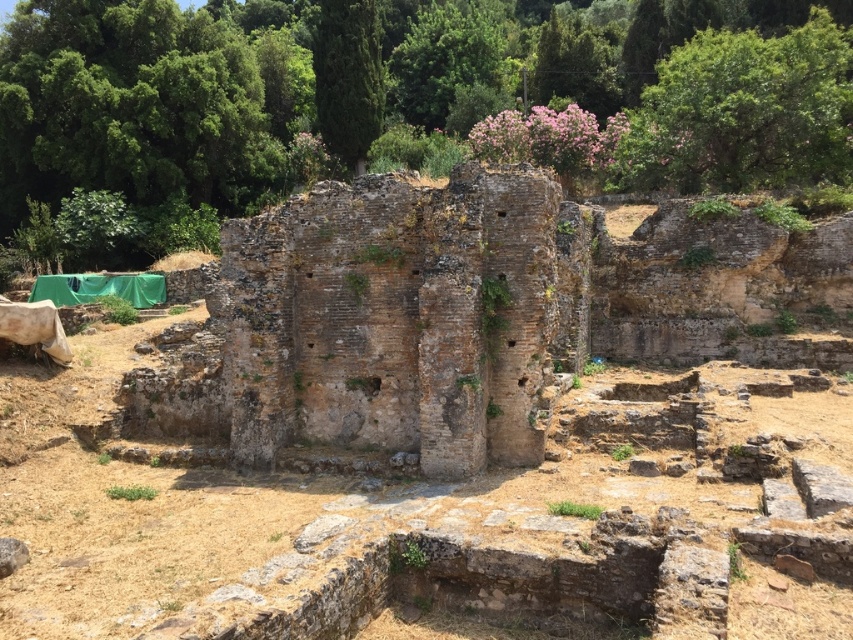
Question: From the image, what is the correct spatial relationship of green leafy tree at upper center in relation to green leafy tree at upper right?

Choices:
 (A) below
 (B) above

Answer: (B)

Question: Is green leafy tree at upper center wider than green leafy tree at upper right?

Choices:
 (A) yes
 (B) no

Answer: (A)

Question: Among these points, which one is farthest from the camera?

Choices:
 (A) tap(288, 33)
 (B) tap(469, 392)
 (C) tap(723, 38)
 (D) tap(367, 120)

Answer: (A)

Question: Among these objects, which one is farthest from the camera?

Choices:
 (A) green leafy tree at upper right
 (B) brown stone ruins at center

Answer: (A)

Question: Which object appears closest to the camera in this image?

Choices:
 (A) green leafy tree at upper center
 (B) green textured tree at upper center
 (C) brown stone ruins at center
 (D) green leafy tree at upper right

Answer: (C)

Question: Is green leafy tree at upper center to the left of green textured tree at upper center from the viewer's perspective?

Choices:
 (A) no
 (B) yes

Answer: (A)